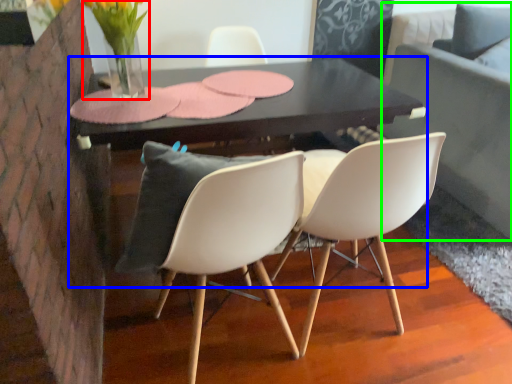
Question: Considering the real-world distances, which object is closest to floral arrangement (highlighted by a red box)? table (highlighted by a blue box) or couch (highlighted by a green box).

Choices:
 (A) table
 (B) couch

Answer: (A)